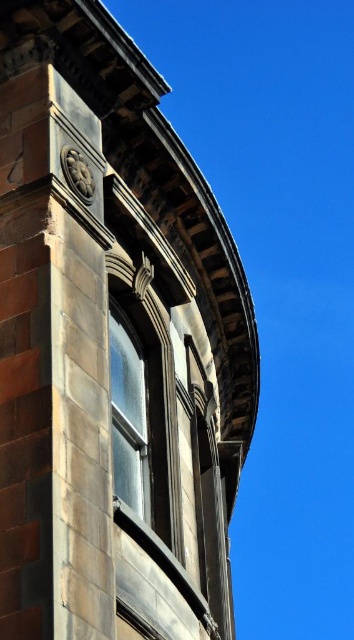
Question: Among these points, which one is farthest from the camera?

Choices:
 (A) (135, 356)
 (B) (54, 541)

Answer: (A)

Question: Does dark gray stone window at center have a smaller size compared to matte glass window at upper center?

Choices:
 (A) no
 (B) yes

Answer: (A)

Question: Does dark gray stone window at center have a larger size compared to matte glass window at upper center?

Choices:
 (A) yes
 (B) no

Answer: (A)

Question: Among these objects, which one is farthest from the camera?

Choices:
 (A) matte glass window at upper center
 (B) dark gray stone window at center

Answer: (A)

Question: Does dark gray stone window at center have a larger size compared to matte glass window at upper center?

Choices:
 (A) yes
 (B) no

Answer: (A)